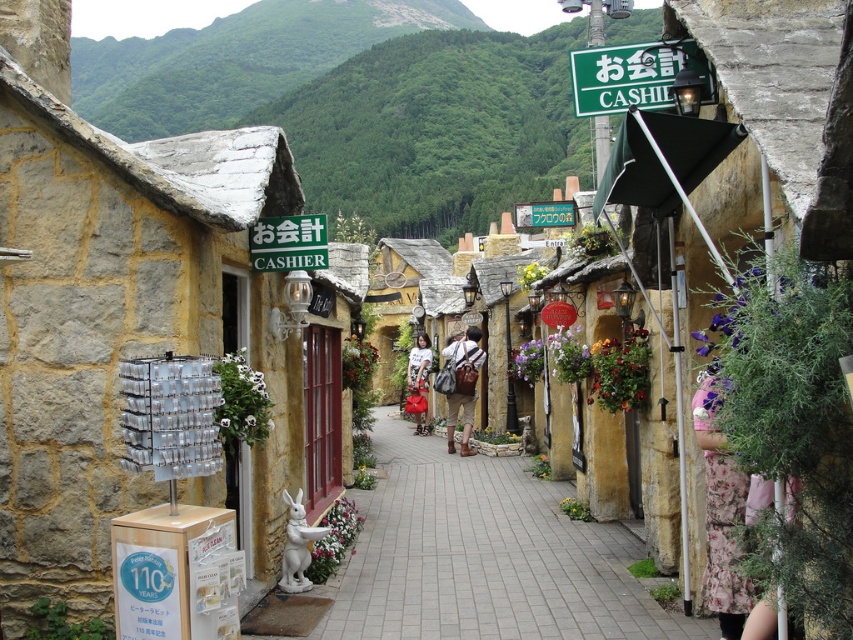
Question: Among these points, which one is nearest to the camera?

Choices:
 (A) (471, 355)
 (B) (653, 600)
 (C) (325, 260)

Answer: (C)

Question: Does paved stone path at center appear on the right side of green plastic sign at center?

Choices:
 (A) yes
 (B) no

Answer: (A)

Question: Can you confirm if green plastic sign at upper center is thinner than matte white shirt at center?

Choices:
 (A) no
 (B) yes

Answer: (A)

Question: Can you confirm if green plastic sign at upper center is positioned to the left of matte white shirt at center?

Choices:
 (A) no
 (B) yes

Answer: (A)

Question: Which point is farther to the camera?

Choices:
 (A) matte brown backpack at center
 (B) green plastic sign at upper center

Answer: (A)

Question: Among these objects, which one is nearest to the camera?

Choices:
 (A) paved stone path at center
 (B) matte brown backpack at center
 (C) green plastic sign at upper center
 (D) green grassy hillside at upper center

Answer: (C)